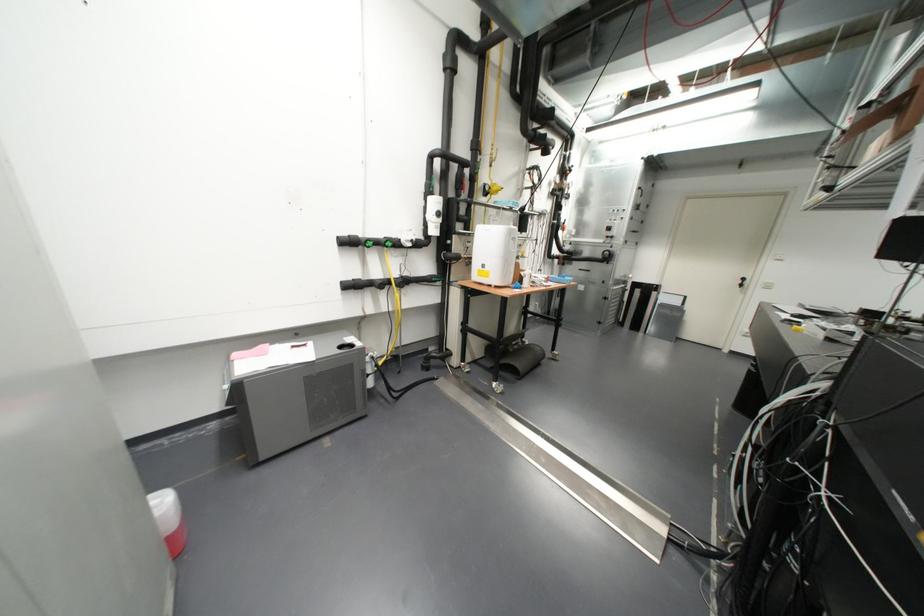
The width and height of the screenshot is (924, 616). What are the coordinates of `black door handle` in the screenshot? It's located at (742, 282).